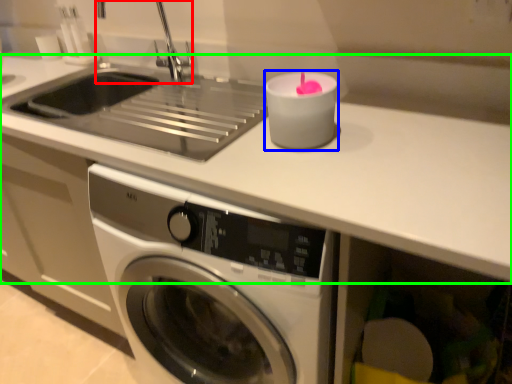
Question: Based on their relative distances, which object is nearer to faucet (highlighted by a red box)? Choose from candle holder (highlighted by a blue box) and counter top (highlighted by a green box).

Choices:
 (A) candle holder
 (B) counter top

Answer: (A)